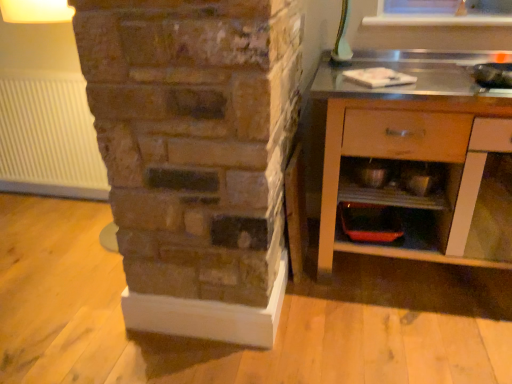
The height and width of the screenshot is (384, 512). In order to click on vacant region below white ribbed radiator at left (from a real-world perspective) in this screenshot , I will do point(61,190).